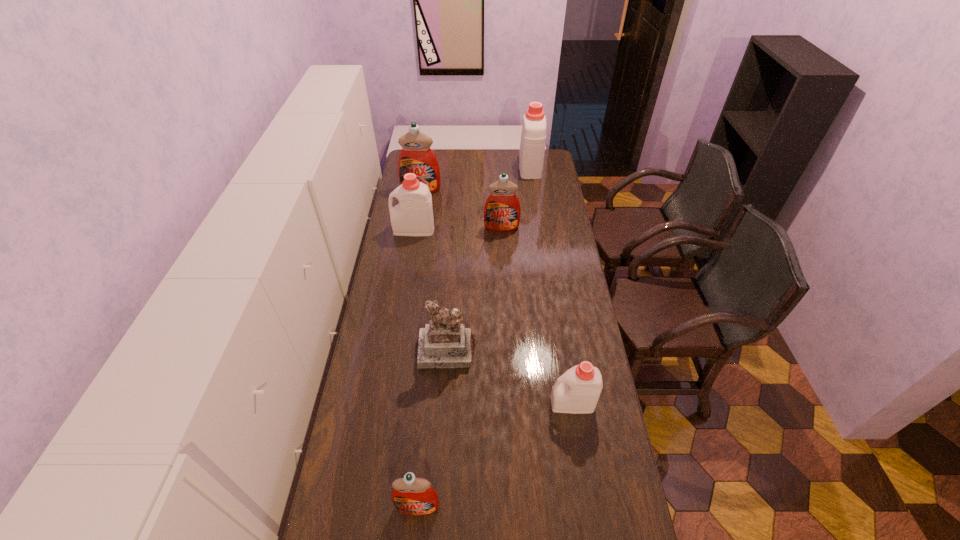
Identify the location of the closest red detergent to the farthest red detergent. (502, 210).

Choose which red detergent is the nearest neighbor to the second biggest red detergent. Please provide its 2D coordinates. Your answer should be formatted as a tuple, i.e. [(x, y)], where the tuple contains the x and y coordinates of a point satisfying the conditions above.

[(416, 156)]

The height and width of the screenshot is (540, 960). Identify the location of free location that satisfies the following two spatial constraints: 1. on the handle side of the nearest white detergent; 2. on the front surface of the nearest red detergent. click(588, 507).